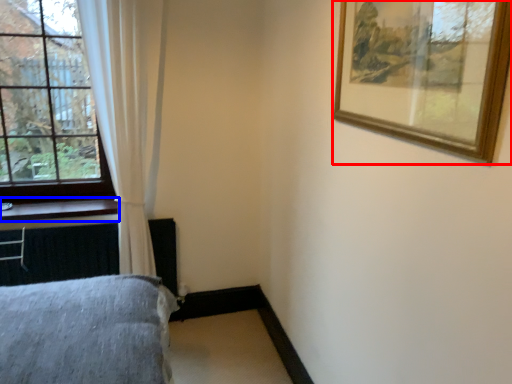
Question: Among these objects, which one is farthest to the camera, picture frame (highlighted by a red box) or window sill (highlighted by a blue box)?

Choices:
 (A) picture frame
 (B) window sill

Answer: (B)